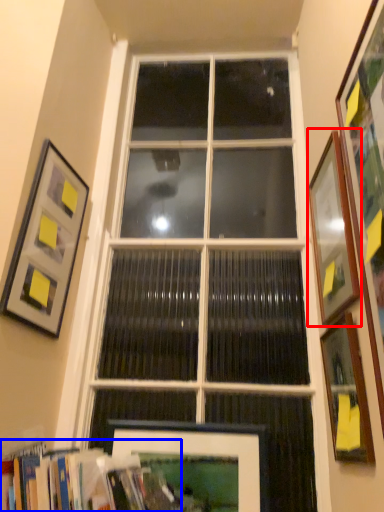
Question: Which object is further to the camera taking this photo, picture frame (highlighted by a red box) or bookcase (highlighted by a blue box)?

Choices:
 (A) picture frame
 (B) bookcase

Answer: (A)